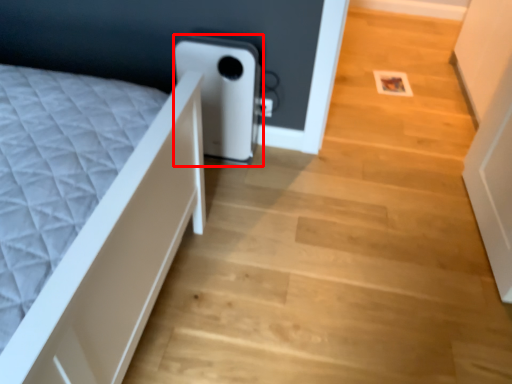
Question: From the image's perspective, what is the correct spatial positioning of water heater (annotated by the red box) in reference to stairwell?

Choices:
 (A) below
 (B) above

Answer: (B)